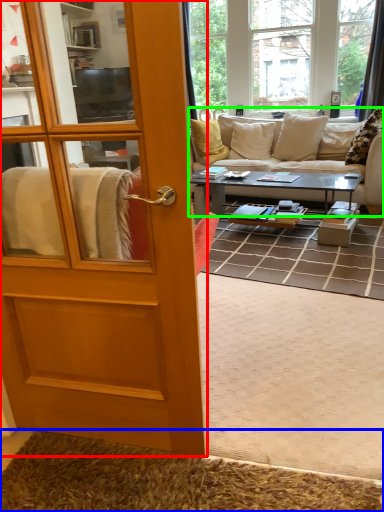
Question: Based on their relative distances, which object is farther from door (highlighted by a red box)? Choose from doormat (highlighted by a blue box) and studio couch (highlighted by a green box).

Choices:
 (A) doormat
 (B) studio couch

Answer: (B)